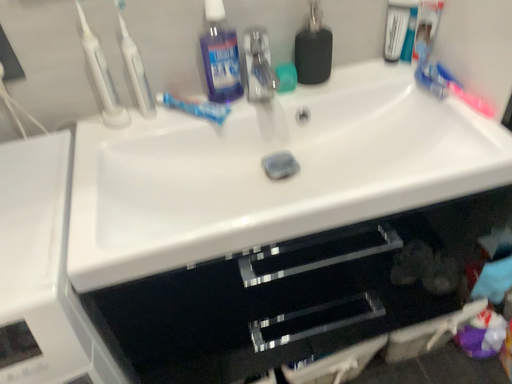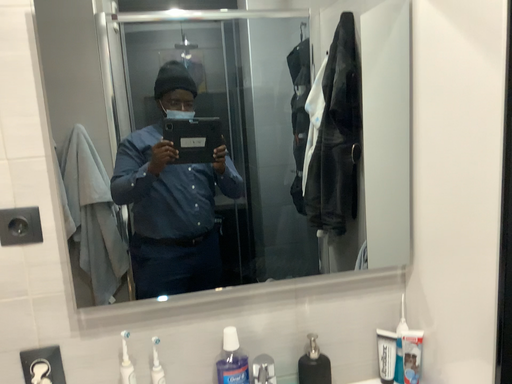
Question: Which way did the camera rotate in the video?

Choices:
 (A) rotated upward
 (B) rotated downward

Answer: (A)